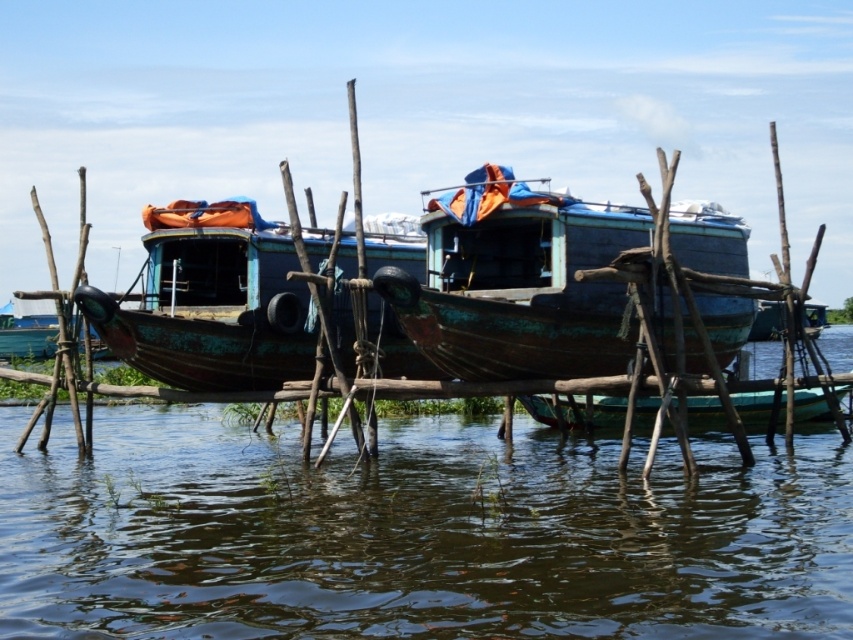
You are standing on the dock and want to step onto the rusty wood boat at center. Based on the scene, which direction should you move relative to the brown murky water at center to reach the boat?

The brown murky water at center is in front of the rusty wood boat at center, so you should move backward away from the brown murky water at center to reach the boat.

You need to board one of the two boats at the center of the image. The rusty wood boat at center and the rusty metal boat at center. Which one has a lower deck height, making it easier to step onto?

The rusty wood boat at center is shorter than the rusty metal boat at center, so it has a lower deck height, making it easier to step onto.